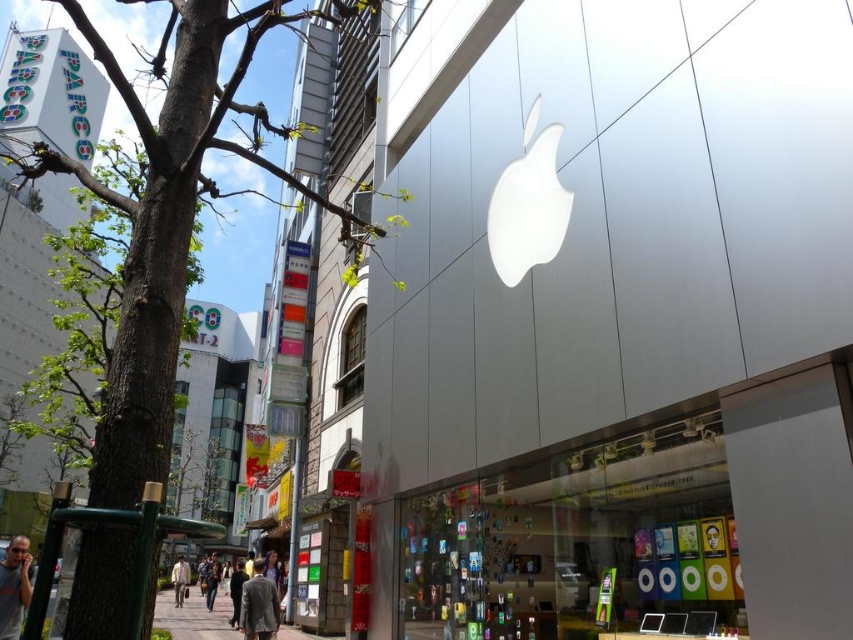
You are a pedestrian standing on the street in front of the Apple Store. You notice the green leafy tree at left and the black fabric pants at lower center. Which object is higher up in the scene?

The green leafy tree at left is positioned over the black fabric pants at lower center, so it is higher up in the scene.

You are standing at the point marked by the coordinates point (x=258, y=604) in the image. What object are you currently standing on?

The point (x=258, y=604) indicates the gray wool coat at lower center, so you are standing on the gray wool coat at lower center.